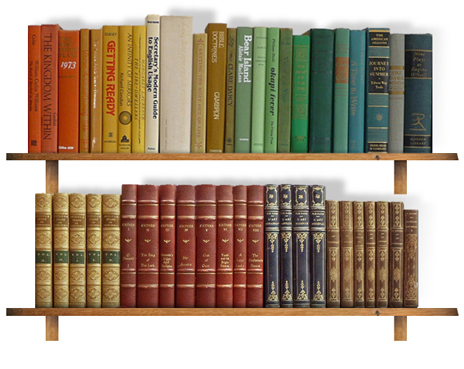
Where is `green books`? This screenshot has width=464, height=369. green books is located at coordinates (243, 106), (257, 91), (270, 83), (283, 105), (297, 107).